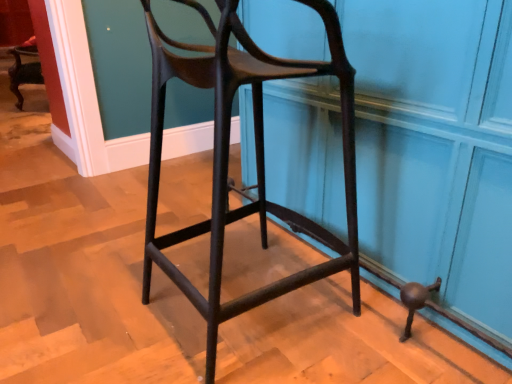
Question: From the image's perspective, is matte black stool at center below matte black stool at center?

Choices:
 (A) no
 (B) yes

Answer: (A)

Question: Is the depth of matte black stool at center greater than that of matte black stool at center?

Choices:
 (A) yes
 (B) no

Answer: (A)

Question: Can you confirm if matte black stool at center is wider than matte black stool at center?

Choices:
 (A) yes
 (B) no

Answer: (A)

Question: Can you see matte black stool at center touching matte black stool at center?

Choices:
 (A) no
 (B) yes

Answer: (A)

Question: Is matte black stool at center facing towards matte black stool at center?

Choices:
 (A) yes
 (B) no

Answer: (A)

Question: From a real-world perspective, is matte black stool at center under matte black stool at center?

Choices:
 (A) no
 (B) yes

Answer: (B)

Question: Is matte black stool at center wider than matte black stool at center?

Choices:
 (A) no
 (B) yes

Answer: (A)

Question: Does matte black stool at center have a larger size compared to matte black stool at center?

Choices:
 (A) no
 (B) yes

Answer: (A)

Question: Does matte black stool at center turn towards matte black stool at center?

Choices:
 (A) yes
 (B) no

Answer: (A)

Question: Considering the relative positions of matte black stool at center and matte black stool at center in the image provided, is matte black stool at center in front of matte black stool at center?

Choices:
 (A) yes
 (B) no

Answer: (A)

Question: Is matte black stool at center thinner than matte black stool at center?

Choices:
 (A) no
 (B) yes

Answer: (B)

Question: Would you say matte black stool at center contains matte black stool at center?

Choices:
 (A) yes
 (B) no

Answer: (B)

Question: Relative to matte black stool at center, is matte black stool at center in front or behind?

Choices:
 (A) behind
 (B) front

Answer: (B)